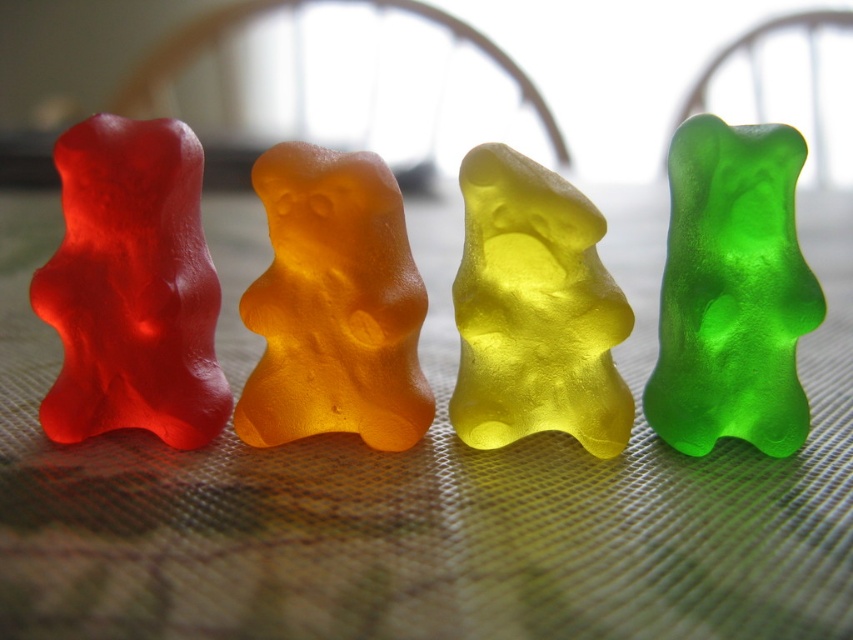
You are a child who wants to eat the yellow translucent gummy bear at center. Looking at the image, which gummy bear is to the right of the translucent gelatin gummy bears at center?

The yellow translucent gummy bear at center is to the right of the translucent gelatin gummy bears at center.

You are a child trying to grab the first gummy bear closest to you from the row of candies. Which one should you reach for, the matte translucent gummy bear at left or the green translucent gummy bear at right?

The matte translucent gummy bear at left is in front of the green translucent gummy bear at right, so you should reach for the matte translucent gummy bear at left as it is closer to you.

You are a child looking at the four gummy bears on the table. You want to pick up the one that is closer to you. Which gummy bear should you choose between the translucent orange gummy bear at center and the yellow translucent gummy bear at center?

The translucent orange gummy bear at center is closer to you than the yellow translucent gummy bear at center, so you should choose the translucent orange gummy bear at center.